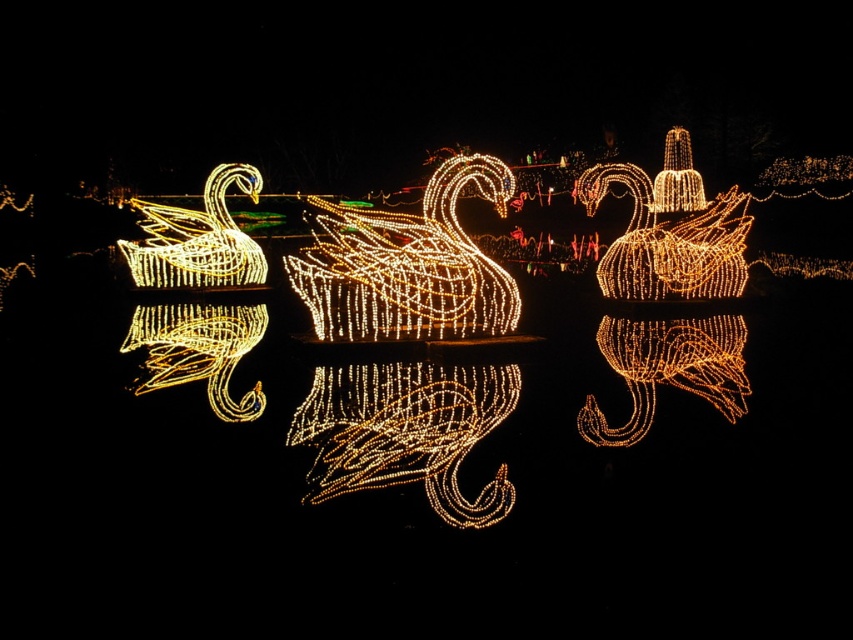
Question: Which object appears farthest from the camera in this image?

Choices:
 (A) illuminated wireframe swan at left
 (B) illuminated wireframe swan at center

Answer: (A)

Question: Which of the following is the closest to the observer?

Choices:
 (A) (227, 284)
 (B) (453, 216)

Answer: (B)

Question: Can you confirm if illuminated wireframe swan at center is wider than illuminated wireframe swan at left?

Choices:
 (A) yes
 (B) no

Answer: (A)

Question: Considering the relative positions of illuminated wireframe swan at center and illuminated wireframe swan at left in the image provided, where is illuminated wireframe swan at center located with respect to illuminated wireframe swan at left?

Choices:
 (A) left
 (B) right

Answer: (B)

Question: Observing the image, what is the correct spatial positioning of illuminated wireframe swan at center in reference to illuminated wireframe swan at left?

Choices:
 (A) right
 (B) left

Answer: (A)